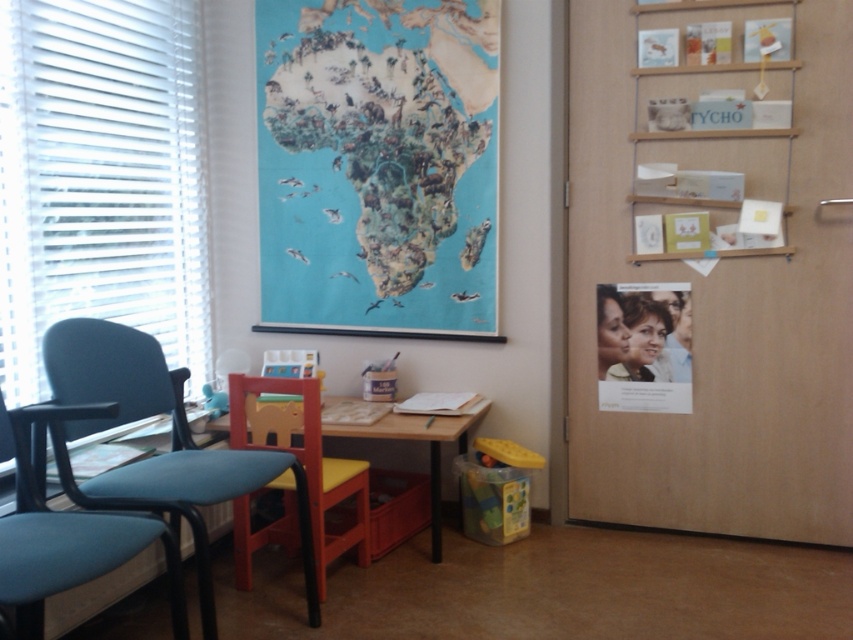
Question: Which point appears closest to the camera in this image?

Choices:
 (A) (738, 529)
 (B) (9, 413)
 (C) (241, 438)

Answer: (B)

Question: Among these objects, which one is farthest from the camera?

Choices:
 (A) matte paper poster at upper right
 (B) wooden table at center
 (C) teal fabric swivel chair at left
 (D) blue paper map at upper center

Answer: (D)

Question: Is yellow fabric chair at center thinner than wooden table at center?

Choices:
 (A) yes
 (B) no

Answer: (A)

Question: Is blue paper map at upper center to the right of teal fabric armchair at left from the viewer's perspective?

Choices:
 (A) no
 (B) yes

Answer: (B)

Question: Is blue paper map at upper center positioned in front of matte paper poster at upper right?

Choices:
 (A) no
 (B) yes

Answer: (A)

Question: Which of the following is the closest to the observer?

Choices:
 (A) matte paper poster at upper right
 (B) teal fabric armchair at left
 (C) wooden table at center

Answer: (B)